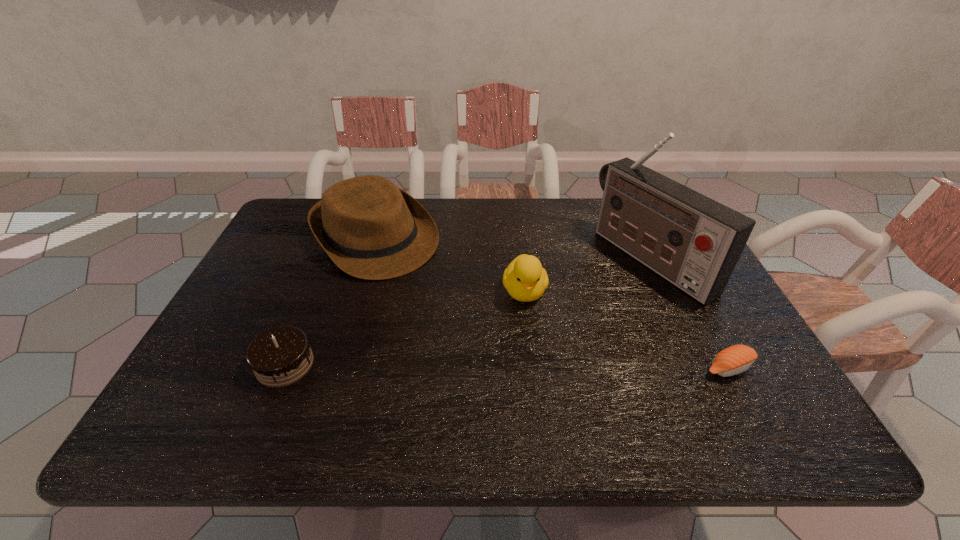
I want to click on chocolate cake, so click(x=280, y=356).

Where is `the shortest object`? The image size is (960, 540). the shortest object is located at coordinates (736, 359).

Find the location of `fedora`. fedora is located at coordinates (370, 229).

The height and width of the screenshot is (540, 960). I want to click on the third object from right to left, so click(x=525, y=279).

Locate an element on the screen. radio receiver is located at coordinates click(694, 242).

The image size is (960, 540). Identify the location of vacant space located on the back of the chocolate cake. (314, 295).

Where is `vacant region located on the back of the shortest object`? This screenshot has height=540, width=960. vacant region located on the back of the shortest object is located at coordinates (695, 305).

At what (x,y) coordinates should I click in order to perform the action: click on free region located on the front-facing side of the fedora. Please return your answer as a coordinate pair (x, y). Image resolution: width=960 pixels, height=540 pixels. Looking at the image, I should click on (428, 292).

Where is `vacant point located on the front-facing side of the fedora`? vacant point located on the front-facing side of the fedora is located at coordinates (488, 353).

Find the location of a particular element. free location located 0.280m on the front-facing side of the fedora is located at coordinates (469, 334).